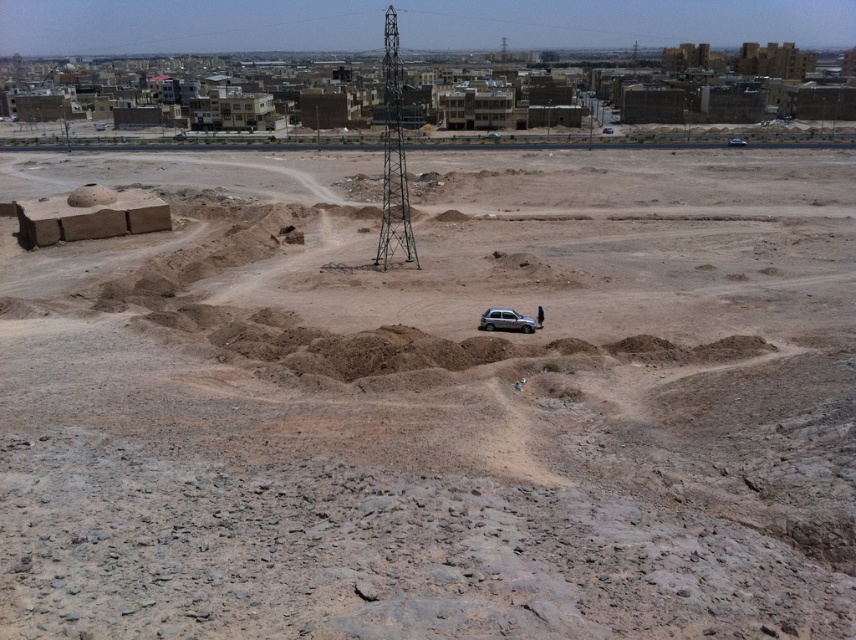
Question: Is metallic structure at center smaller than silver metallic car at center?

Choices:
 (A) yes
 (B) no

Answer: (B)

Question: In this image, where is metallic structure at center located relative to silver metallic car at center?

Choices:
 (A) right
 (B) left

Answer: (B)

Question: Among these objects, which one is nearest to the camera?

Choices:
 (A) silver metallic car at center
 (B) metallic structure at center

Answer: (A)

Question: Which of the following is the farthest from the observer?

Choices:
 (A) metallic structure at center
 (B) silver metallic car at center

Answer: (A)

Question: Where is metallic structure at center located in relation to silver metallic car at center in the image?

Choices:
 (A) right
 (B) left

Answer: (B)